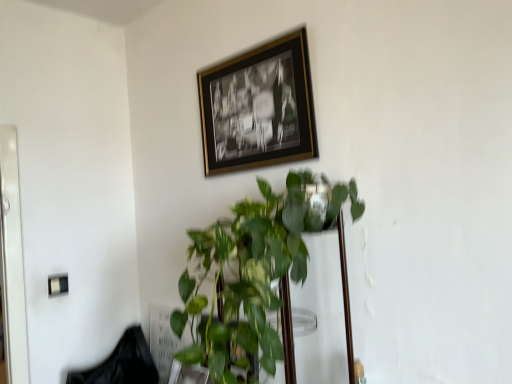
Question: Is black fabric swivel chair at lower left situated inside green glossy plant at center or outside?

Choices:
 (A) outside
 (B) inside

Answer: (A)

Question: From the image's perspective, is black fabric swivel chair at lower left located above or below green glossy plant at center?

Choices:
 (A) above
 (B) below

Answer: (B)

Question: Estimate the real-world distances between objects in this image. Which object is farther from the green glossy plant at center?

Choices:
 (A) black fabric swivel chair at lower left
 (B) gold-framed photo at upper center

Answer: (A)

Question: Which is nearer to the black fabric swivel chair at lower left?

Choices:
 (A) green glossy plant at center
 (B) gold-framed photo at upper center

Answer: (A)